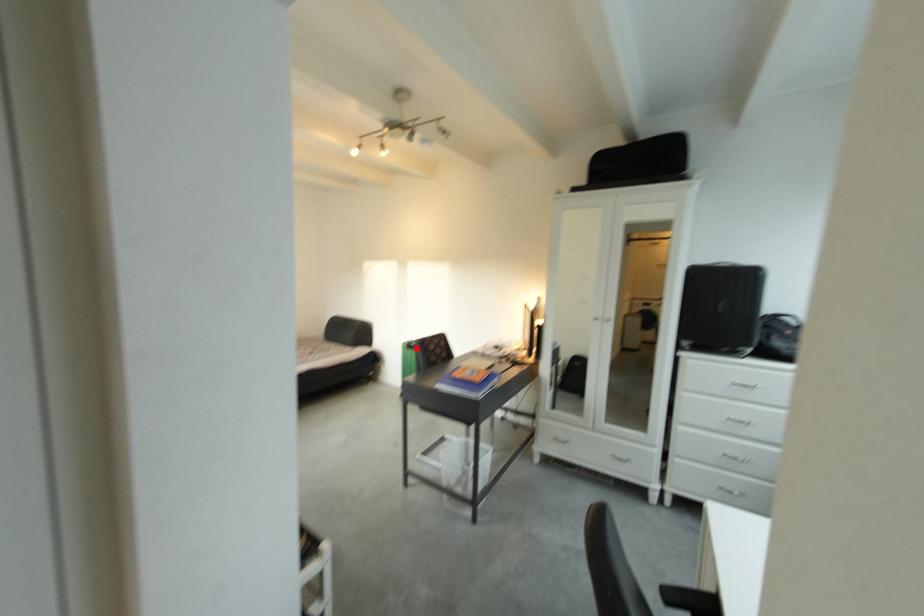
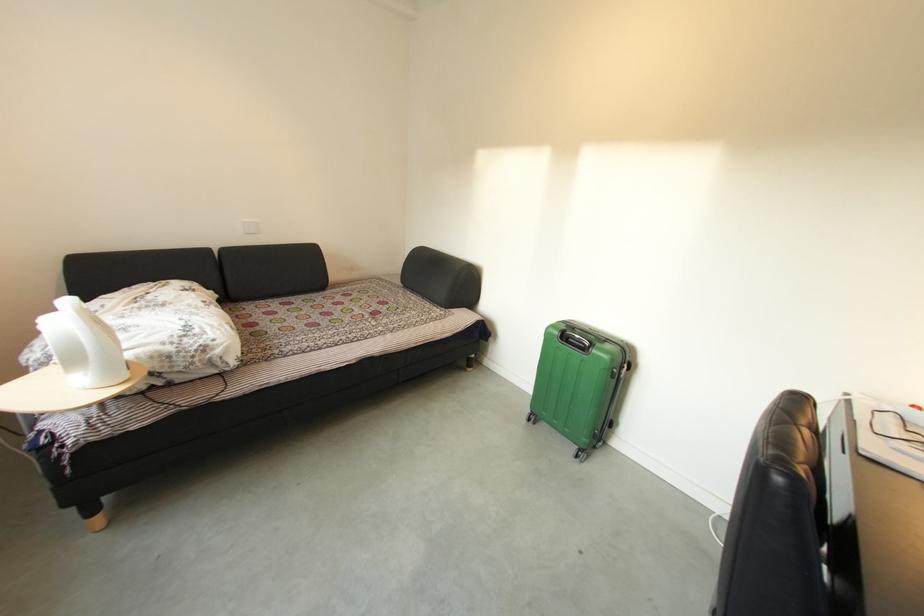
Find the pixel in the second image that matches the highlighted location in the first image.

(568, 336)